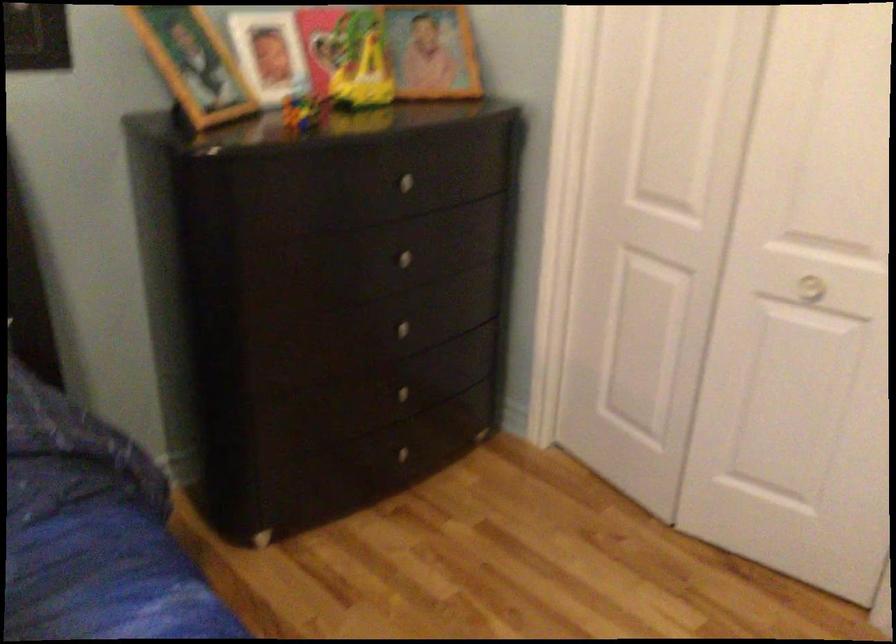
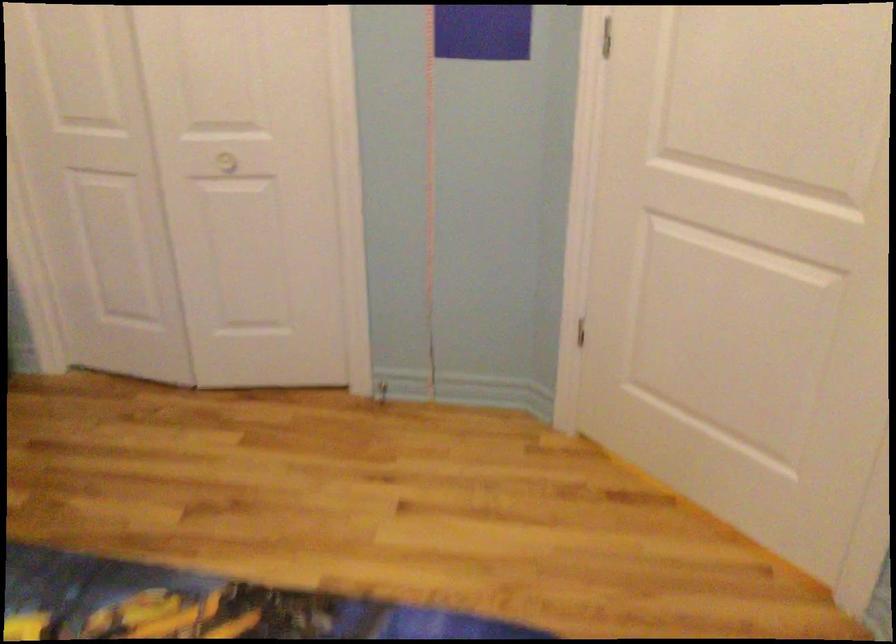
Question: The images are taken continuously from a first-person perspective. In which direction is your viewpoint rotating?

Choices:
 (A) Left
 (B) Right
 (C) Up
 (D) Down

Answer: (B)